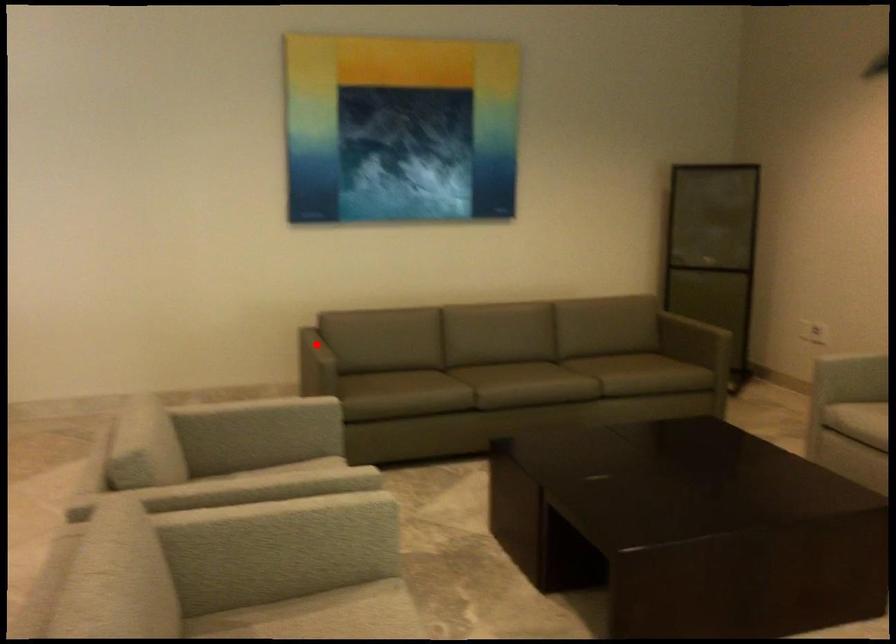
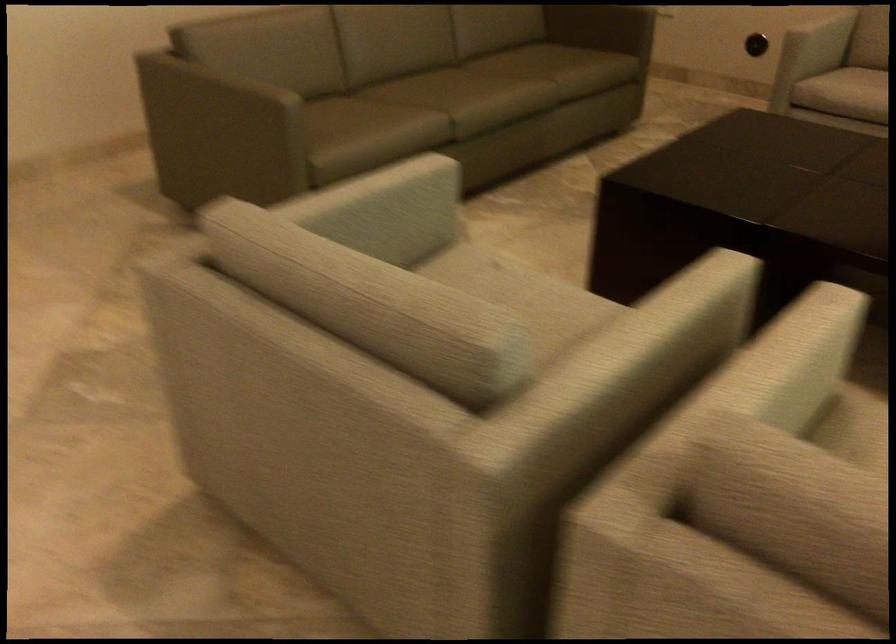
Question: I am providing you with two images of the same scene from different viewpoints. A red point is shown in image1. For the corresponding object point in image2, is it positioned nearer or farther from the camera?

Choices:
 (A) Nearer
 (B) Farther

Answer: (A)